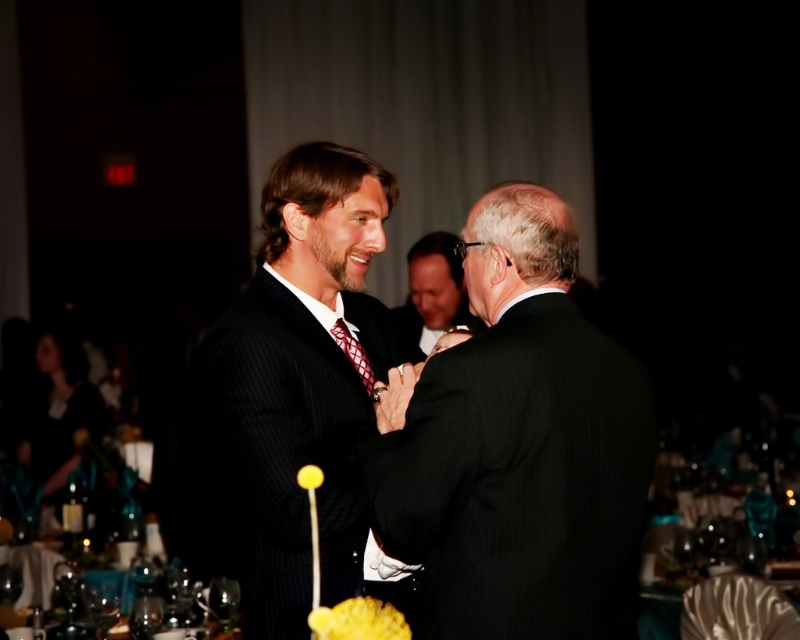
You are a photographer at a formal event. You need to capture a photo where both the silky black dress at lower left and the smooth black suit at center are visible. Considering their heights, which one should you position closer to the camera to ensure both are fully visible in the frame?

The silky black dress at lower left has a greater height compared to smooth black suit at center. To ensure both are fully visible, position the silky black dress at lower left closer to the camera so its height doesn

Based on the photo, you are a photographer at this event and want to capture a photo of both the black pinstripe suit at center and the silky black dress at lower left. Which one of these two items is narrower in width?

The black pinstripe suit at center is thinner than silky black dress at lower left, so the black pinstripe suit at center is narrower in width.

You are at the point labeled as point (454,305) and want to move towards the exit located at point (50,328). Is there any obstruction between your current position and the exit?

Point (50,328) is behind point (454,305), so there is an obstruction between your current position and the exit.